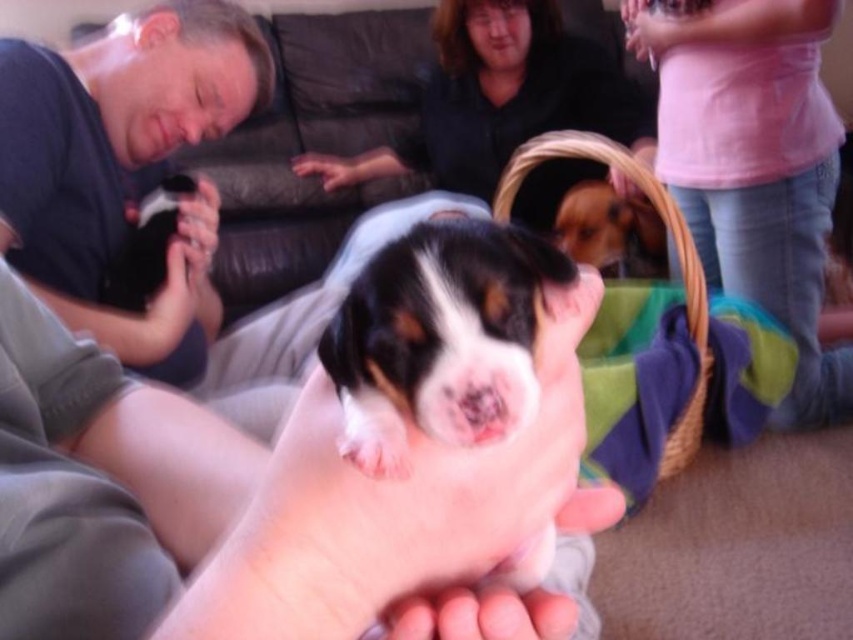
Describe the element at coordinates (610, 230) in the screenshot. I see `brown fur basket at upper center` at that location.

Can you confirm if brown fur basket at upper center is bigger than matte pink hand at upper center?

Indeed, brown fur basket at upper center has a larger size compared to matte pink hand at upper center.

You are a GUI agent. You are given a task and a screenshot of the screen. Output one action in this format:
    pyautogui.click(x=<x>, y=<y>)
    Task: Click on the brown fur basket at upper center
    The height and width of the screenshot is (640, 853).
    Given the screenshot: What is the action you would take?
    pyautogui.click(x=610, y=230)

This screenshot has width=853, height=640. Identify the location of brown fur basket at upper center. (610, 230).

Between matte black shirt at left and smooth skin hand at center, which one is positioned lower?

matte black shirt at left is lower down.

Can you confirm if matte black shirt at left is smaller than smooth skin hand at center?

Actually, matte black shirt at left might be larger than smooth skin hand at center.

At what (x,y) coordinates should I click in order to perform the action: click on matte black shirt at left. Please return your answer as a coordinate pair (x, y). This screenshot has height=640, width=853. Looking at the image, I should click on (125, 168).

Does white fur puppy at center come behind woven straw basket at upper center?

No, it is not.

Can you confirm if white fur puppy at center is smaller than woven straw basket at upper center?

Correct, white fur puppy at center occupies less space than woven straw basket at upper center.

Where is `white fur puppy at center`? white fur puppy at center is located at coordinates (439, 337).